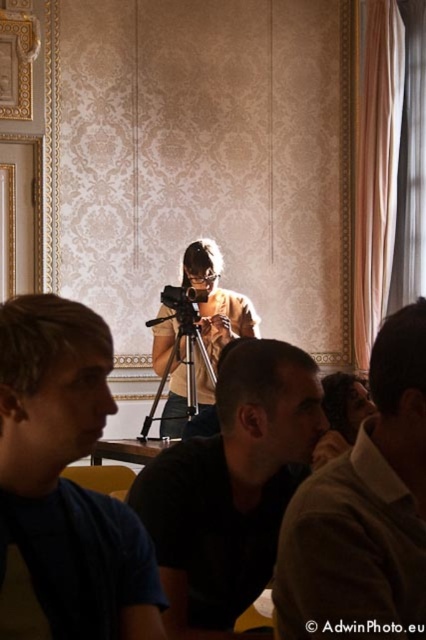
You are a photographer setting up equipment in the room. You need to adjust the camera on the silver metallic tripod at center so that it can capture the dark brown leather jacket at center clearly. Is the tripod currently blocking the view of the jacket?

The dark brown leather jacket at center is in front of the silver metallic tripod at center, so the tripod is not blocking the view of the jacket.

You are standing in the room and want to touch the point at coordinates point (x=365, y=512). Which object will you be touching?

The point at coordinates point (x=365, y=512) is located on the dark brown leather jacket at center, so you will be touching the dark brown leather jacket at center.